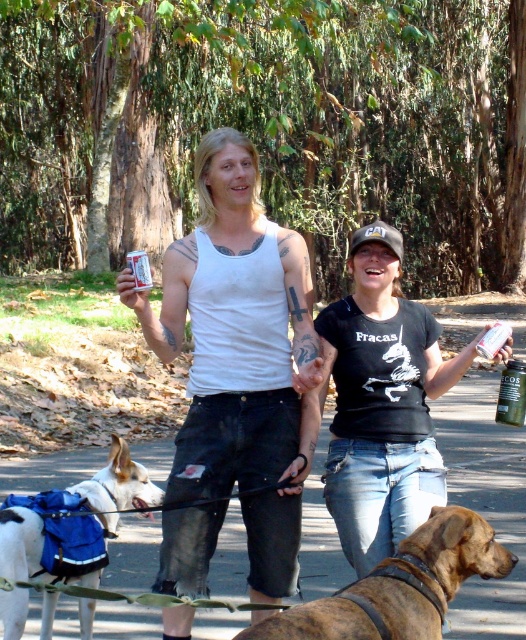
Describe the element at coordinates (399, 586) in the screenshot. The width and height of the screenshot is (526, 640). I see `brindle leather collar at lower center` at that location.

Can you confirm if brindle leather collar at lower center is taller than green glass bottle at right?

Yes, brindle leather collar at lower center is taller than green glass bottle at right.

Is point (493, 556) positioned behind point (498, 348)?

That is False.

Locate an element on the screen. brindle leather collar at lower center is located at coordinates (399, 586).

Is white cotton tank top at center positioned before white plastic can at center?

No, it is behind white plastic can at center.

Does point (268, 548) come farther from viewer compared to point (148, 262)?

No, (268, 548) is in front of (148, 262).

Identify the location of white cotton tank top at center. The image size is (526, 640). (234, 326).

Image resolution: width=526 pixels, height=640 pixels. Describe the element at coordinates (382, 403) in the screenshot. I see `black cotton t-shirt at center` at that location.

Who is taller, black cotton t-shirt at center or white fabric dog at lower left?

white fabric dog at lower left is taller.

Locate an element on the screen. black cotton t-shirt at center is located at coordinates (382, 403).

Where is `black cotton t-shirt at center`? black cotton t-shirt at center is located at coordinates (382, 403).